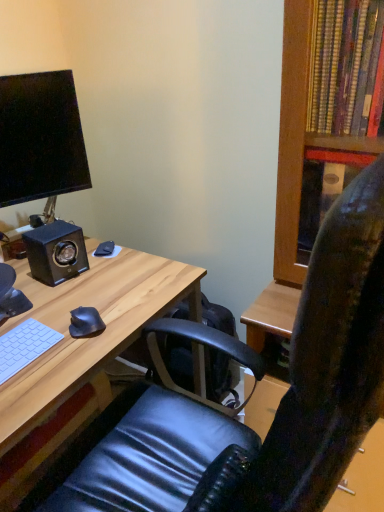
Question: Looking at their shapes, would you say white matte keyboard at lower left is wider or thinner than black matte speaker at left?

Choices:
 (A) wide
 (B) thin

Answer: (B)

Question: In terms of height, does white matte keyboard at lower left look taller or shorter compared to black matte speaker at left?

Choices:
 (A) short
 (B) tall

Answer: (A)

Question: Estimate the real-world distances between objects in this image. Which object is farther from the black matte speaker at left?

Choices:
 (A) black leather chair at center
 (B) matte black monitor at upper left
 (C) black matte mouse at lower left, marked as the 1th mouse in a front-to-back arrangement
 (D) black matte mouse at lower left, which is the first mouse in back-to-front order
 (E) light wood desk at center

Answer: (A)

Question: Considering the real-world distances, which object is farthest from the black matte mouse at lower left, marked as the second mouse in a top-to-bottom arrangement?

Choices:
 (A) black matte speaker at left
 (B) white matte keyboard at lower left
 (C) black matte mouse at lower left, the second mouse when ordered from bottom to top
 (D) black leather chair at center
 (E) light wood desk at center

Answer: (D)